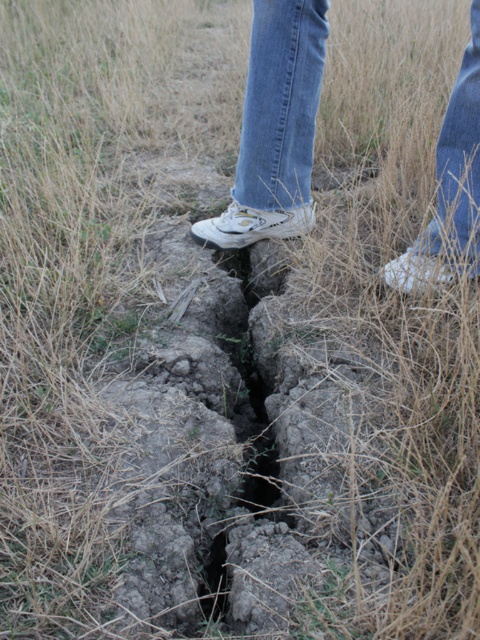
Is point (300, 81) farther from camera compared to point (425, 230)?

Yes, point (300, 81) is behind point (425, 230).

Is denim at center above denim at right?

Correct, denim at center is located above denim at right.

This screenshot has height=640, width=480. In order to click on denim at center in this screenshot , I will do `click(280, 102)`.

Between white canvas sneakers at center and denim at center, which one has more height?

With more height is white canvas sneakers at center.

Is white canvas sneakers at center positioned at the back of denim at center?

Yes, white canvas sneakers at center is behind denim at center.

Does point (301, 170) lie in front of point (320, 88)?

No, (301, 170) is behind (320, 88).

At what (x,y) coordinates should I click in order to perform the action: click on white canvas sneakers at center. Please return your answer as a coordinate pair (x, y). Image resolution: width=480 pixels, height=640 pixels. Looking at the image, I should click on (275, 125).

Between white canvas sneakers at center and denim at right, which one is positioned lower?

denim at right is below.

Between point (240, 202) and point (454, 205), which one is positioned in front?

Point (454, 205) is in front.

Where is `white canvas sneakers at center`? white canvas sneakers at center is located at coordinates (275, 125).

Where is `white canvas sneakers at center`? The image size is (480, 640). white canvas sneakers at center is located at coordinates (275, 125).